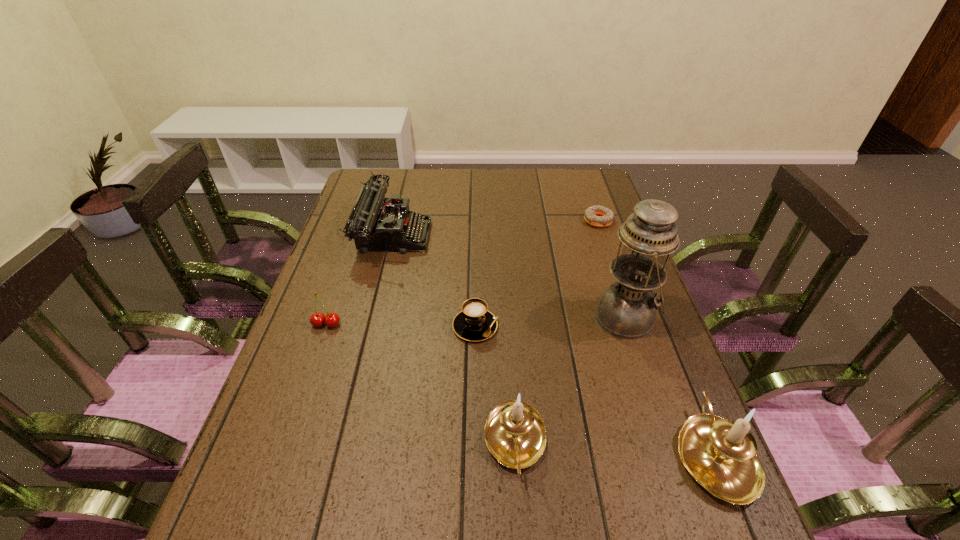
The image size is (960, 540). In order to click on vacant space located on the handle side of the right candle holder in this screenshot , I will do `click(687, 387)`.

I want to click on vacant area located on the back of the shortest object, so click(x=591, y=200).

Identify the location of vacant space located 0.070m on the keyboard of the typewriter. (451, 235).

You are a GUI agent. You are given a task and a screenshot of the screen. Output one action in this format:
    pyautogui.click(x=<x>, y=<y>)
    Task: Click on the free spot located on the left of the tallest object
    This screenshot has height=540, width=960.
    Given the screenshot: What is the action you would take?
    pyautogui.click(x=488, y=317)

Where is `free location located 0.110m with the stems of the third shortest object pointing upwards`? This screenshot has width=960, height=540. free location located 0.110m with the stems of the third shortest object pointing upwards is located at coordinates (312, 366).

Image resolution: width=960 pixels, height=540 pixels. What are the coordinates of `free location located on the left of the second shortest object` in the screenshot? It's located at (350, 326).

Where is `typewriter present at the left edge`? typewriter present at the left edge is located at coordinates (372, 224).

Locate an element on the screen. cherry present at the left edge is located at coordinates (317, 319).

Image resolution: width=960 pixels, height=540 pixels. I want to click on candle holder that is positioned at the right edge, so click(720, 454).

This screenshot has width=960, height=540. Find the location of `doughnut present at the right edge`. doughnut present at the right edge is located at coordinates (592, 215).